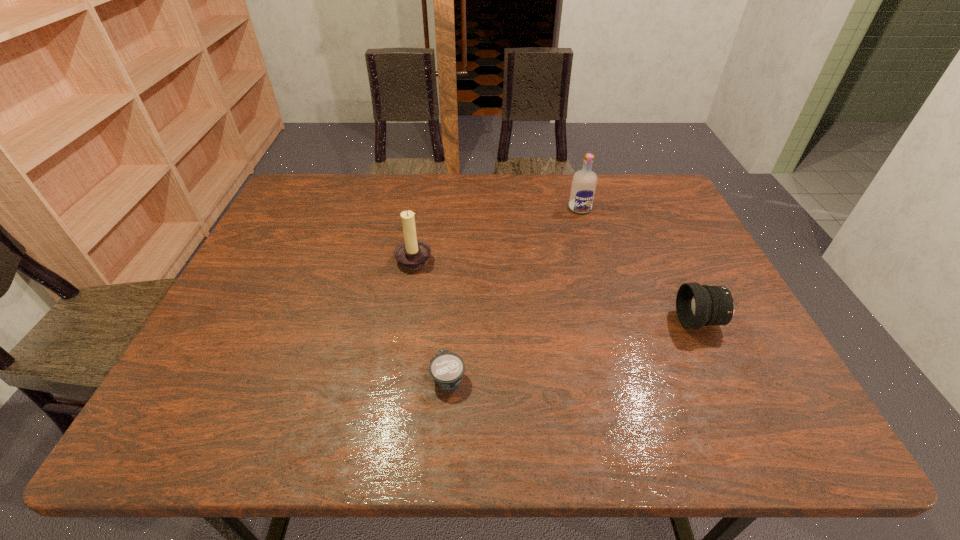
Find the location of `vodka`. vodka is located at coordinates (584, 182).

The width and height of the screenshot is (960, 540). What are the coordinates of `the farthest object` in the screenshot? It's located at (584, 182).

Find the location of a particular element. Image resolution: width=960 pixels, height=540 pixels. candle holder is located at coordinates (413, 254).

Where is `the leftmost object`? the leftmost object is located at coordinates (413, 254).

This screenshot has height=540, width=960. I want to click on the third farthest object, so click(x=697, y=305).

Find the location of a particular element. The height and width of the screenshot is (540, 960). the third tallest object is located at coordinates (697, 305).

Image resolution: width=960 pixels, height=540 pixels. I want to click on the nearest object, so click(x=446, y=368).

Identify the location of the second object from left to right. The height and width of the screenshot is (540, 960). (446, 368).

Locate an element on the screen. blank space located on the label of the farthest object is located at coordinates (598, 271).

Locate an element on the screen. The height and width of the screenshot is (540, 960). free spot located on the wick of the third nearest object is located at coordinates (469, 258).